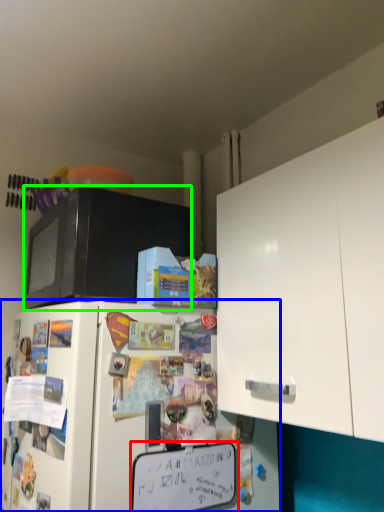
Question: Which object is the closest to the bulletin board (highlighted by a red box)? Choose among these: refrigerator (highlighted by a blue box) or microwave oven (highlighted by a green box).

Choices:
 (A) refrigerator
 (B) microwave oven

Answer: (A)